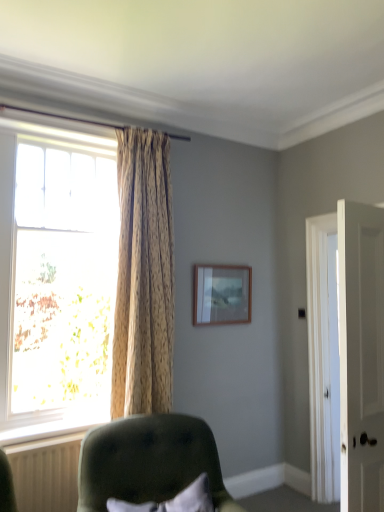
Question: Should I look upward or downward to see white smooth door at right?

Choices:
 (A) up
 (B) down

Answer: (B)

Question: Is translucent glass window at left positioned in front of white plastic radiator at lower left?

Choices:
 (A) no
 (B) yes

Answer: (A)

Question: From the image's perspective, is translucent glass window at left on top of white plastic radiator at lower left?

Choices:
 (A) no
 (B) yes

Answer: (B)

Question: From the image's perspective, does translucent glass window at left appear lower than white plastic radiator at lower left?

Choices:
 (A) yes
 (B) no

Answer: (B)

Question: Can you confirm if translucent glass window at left is positioned to the right of white plastic radiator at lower left?

Choices:
 (A) yes
 (B) no

Answer: (A)

Question: Does translucent glass window at left have a lesser width compared to white plastic radiator at lower left?

Choices:
 (A) no
 (B) yes

Answer: (A)

Question: Considering the relative sizes of translucent glass window at left and white plastic radiator at lower left in the image provided, is translucent glass window at left smaller than white plastic radiator at lower left?

Choices:
 (A) yes
 (B) no

Answer: (B)

Question: Is white plastic radiator at lower left turned away from soft white pillow at lower center?

Choices:
 (A) yes
 (B) no

Answer: (B)

Question: Would you say white plastic radiator at lower left is outside soft white pillow at lower center?

Choices:
 (A) yes
 (B) no

Answer: (A)

Question: Considering the relative sizes of white plastic radiator at lower left and soft white pillow at lower center in the image provided, is white plastic radiator at lower left shorter than soft white pillow at lower center?

Choices:
 (A) no
 (B) yes

Answer: (A)

Question: From a real-world perspective, is white plastic radiator at lower left below soft white pillow at lower center?

Choices:
 (A) no
 (B) yes

Answer: (A)

Question: From a real-world perspective, is white plastic radiator at lower left on soft white pillow at lower center?

Choices:
 (A) yes
 (B) no

Answer: (A)

Question: Would you consider white plastic radiator at lower left to be distant from soft white pillow at lower center?

Choices:
 (A) yes
 (B) no

Answer: (B)

Question: Is translucent glass window at left placed right next to wooden frame at upper center?

Choices:
 (A) no
 (B) yes

Answer: (A)